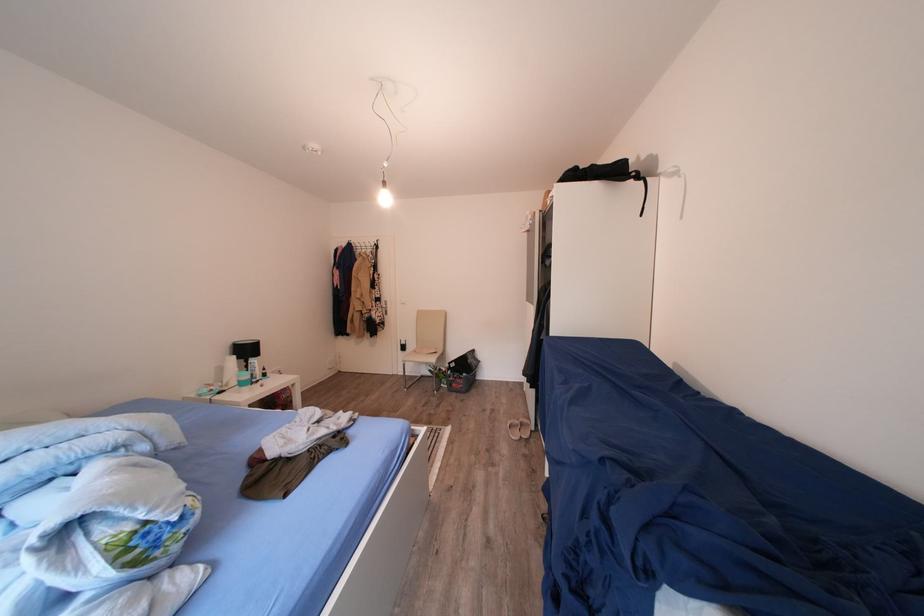
Find where to screw the light bulb. Please return your answer as a coordinate pair (x, y).

(383, 192)